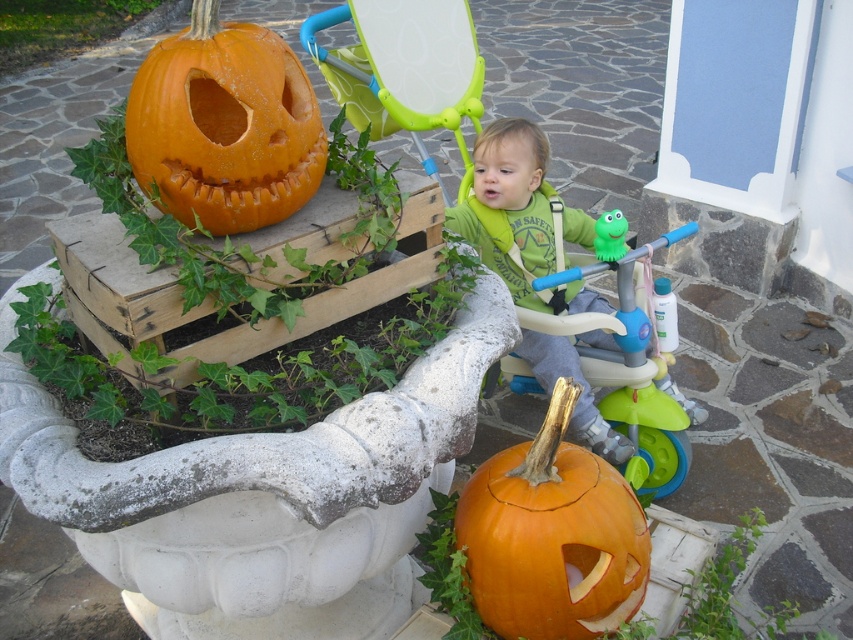
You are a parent carrying a toddler and need to place a Halloween decoration. You have a green plastic baby carriage at center and an orange matte pumpkin at lower center. Can you safely place the pumpkin within 30 inches of the carriage without it being too close?

The green plastic baby carriage at center is 33.39 inches away from the orange matte pumpkin at lower center. Since 33.39 inches is more than 30 inches, the pumpkin is already placed safely beyond the 30 inch distance from the carriage.

You are standing on the patio and want to pick up the green matte shirt at center. Which object is in your way? The orange matte pumpkin at lower center or the carved pumpkin in the planter?

The orange matte pumpkin at lower center is closer to the viewer than the green matte shirt at center, so it is in your way.

You are standing at the center of the patio and want to place a small Halloween decoration in the exact center of the green plastic baby carriage at center. According to the image, where should you place the decoration?

The exact center of the green plastic baby carriage at center is located at point coordinates of (515, 225), so you should place the decoration there.